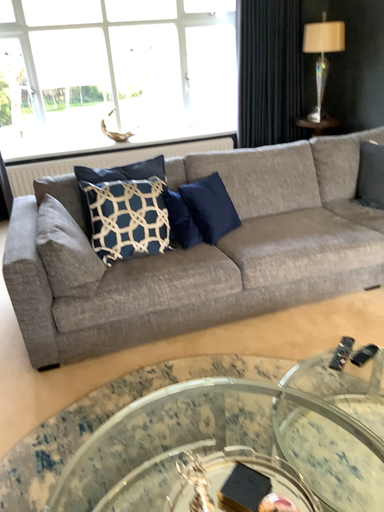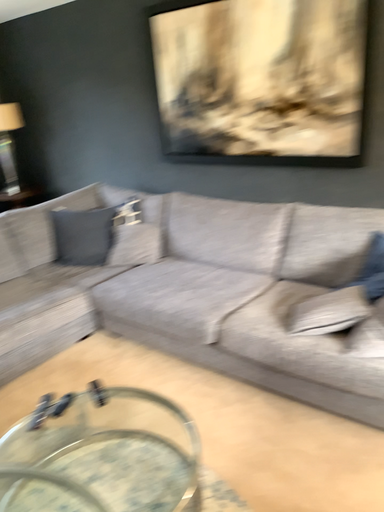
Question: How did the camera likely rotate when shooting the video?

Choices:
 (A) rotated downward
 (B) rotated upward

Answer: (B)